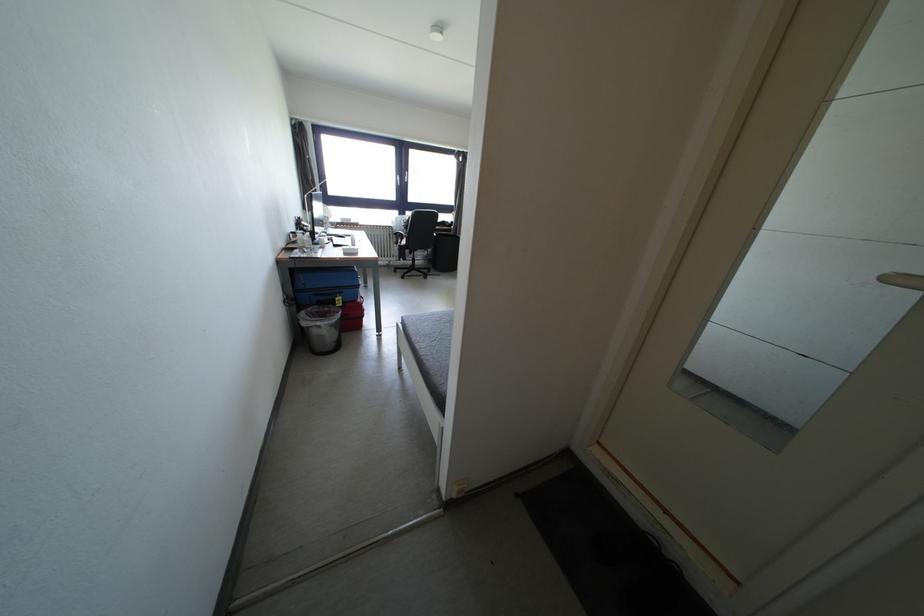
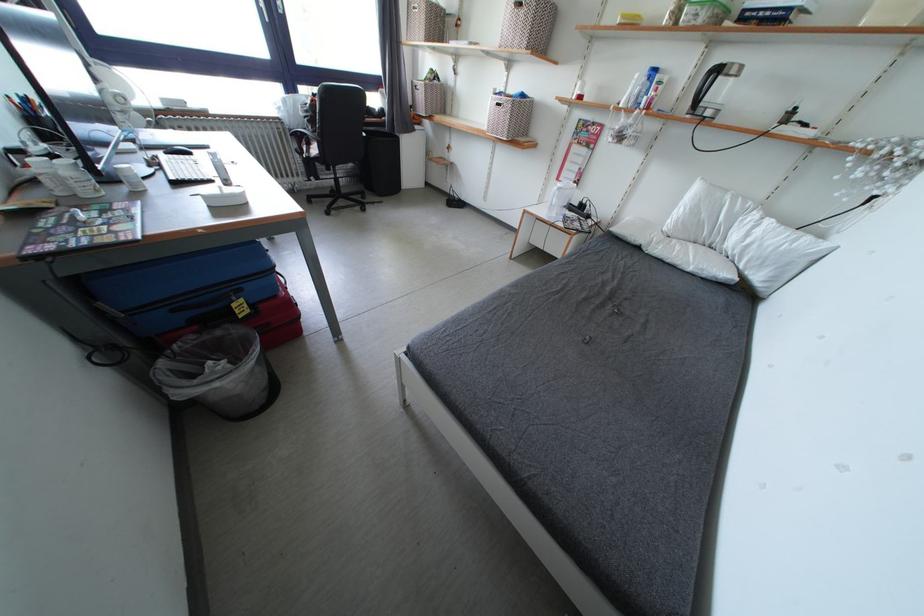
In a continuous first-person perspective shot, in which direction is the camera moving?

The movement direction of the cameraman is left, forward.